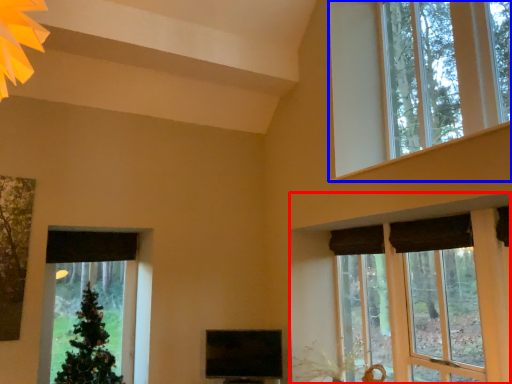
Question: Which object is further to the camera taking this photo, window (highlighted by a red box) or window (highlighted by a blue box)?

Choices:
 (A) window
 (B) window

Answer: (B)